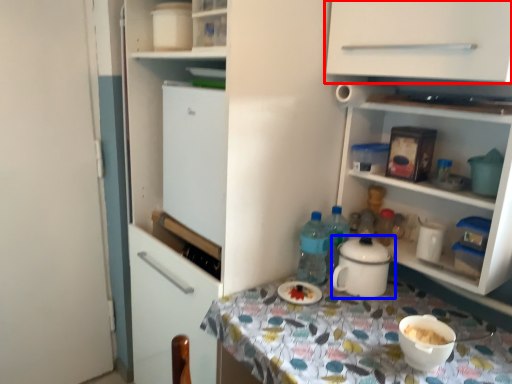
Question: Which object is further to the camera taking this photo, cabinetry (highlighted by a red box) or kitchen appliance (highlighted by a blue box)?

Choices:
 (A) cabinetry
 (B) kitchen appliance

Answer: (B)